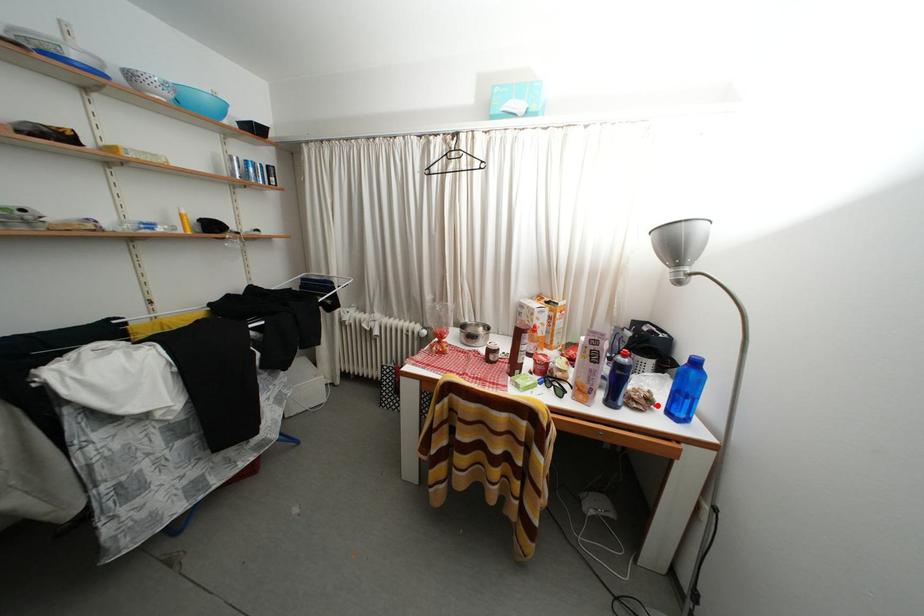
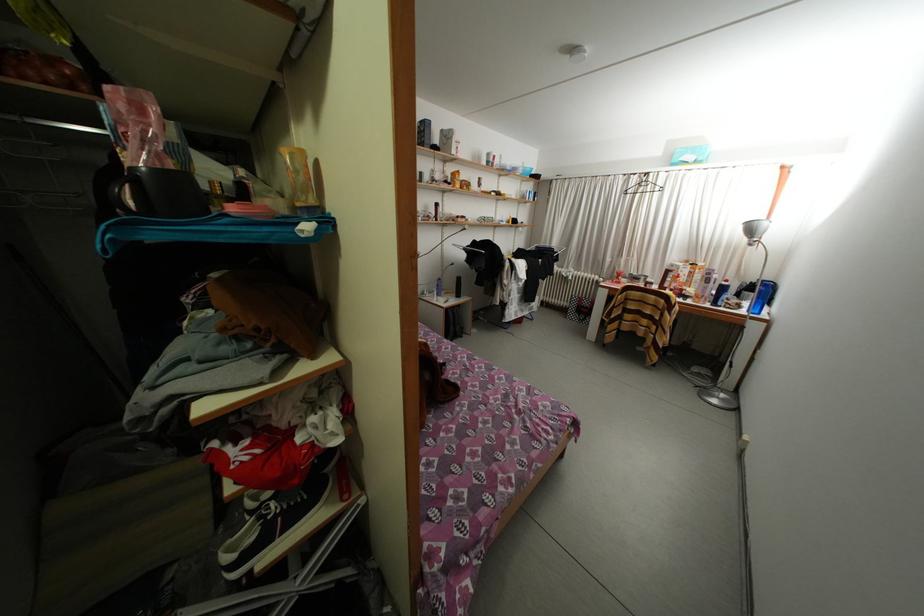
The point at the highlighted location is marked in the first image. Where is the corresponding point in the second image?

(747, 310)